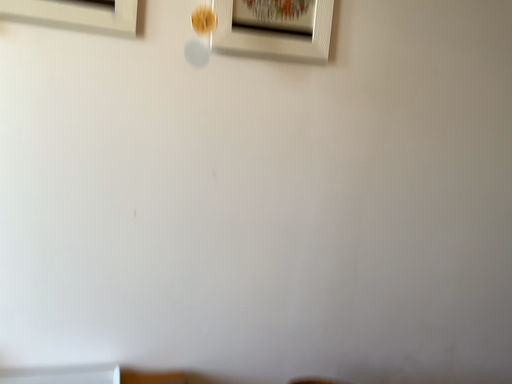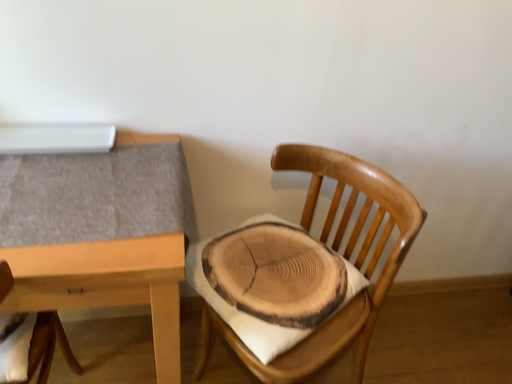
Question: How did the camera likely rotate when shooting the video?

Choices:
 (A) rotated left
 (B) rotated right

Answer: (A)